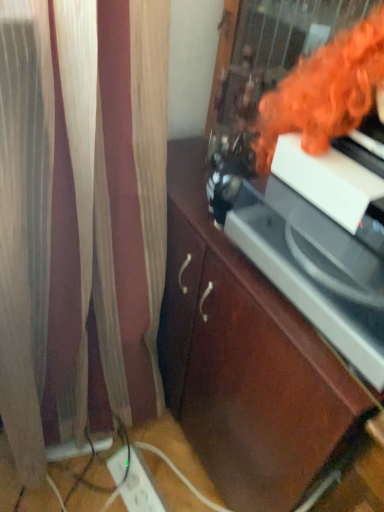
The width and height of the screenshot is (384, 512). What do you see at coordinates (310, 272) in the screenshot?
I see `white glossy record player at center` at bounding box center [310, 272].

What do you see at coordinates (134, 481) in the screenshot? This screenshot has width=384, height=512. I see `white plastic extension cord at lower left` at bounding box center [134, 481].

Find the location of a particular element. The height and width of the screenshot is (512, 384). white plastic extension cord at lower left is located at coordinates 134,481.

Find the location of a particular element. This screenshot has width=384, height=512. white glossy record player at center is located at coordinates (310, 272).

Is orange fabric at upper right inside white plastic extension cord at lower left?

No, white plastic extension cord at lower left does not contain orange fabric at upper right.

Is white plastic extension cord at lower left oriented away from orange fabric at upper right?

white plastic extension cord at lower left is not turned away from orange fabric at upper right.

From the image's perspective, which one is positioned lower, white plastic extension cord at lower left or orange fabric at upper right?

white plastic extension cord at lower left appears lower in the image.

Is point (322, 109) behind point (332, 342)?

No, (322, 109) is in front of (332, 342).

In the scene shown: Based on their sizes in the image, would you say orange fabric at upper right is bigger or smaller than white glossy record player at center?

orange fabric at upper right is bigger than white glossy record player at center.

Is white glossy record player at center with white plastic extension cord at lower left?

They are not placed beside each other.

Could you tell me if white glossy record player at center is turned towards white plastic extension cord at lower left?

No, white glossy record player at center is not aimed at white plastic extension cord at lower left.

I want to click on appliance that appears in front of the white plastic extension cord at lower left, so click(310, 272).

Locate an element on the screen. cabinetry on the left of orange fabric at upper right is located at coordinates (245, 361).

From a real-world perspective, is orange fabric at upper right positioned above or below brown wood cabinet at center?

Clearly, from a real-world perspective, orange fabric at upper right is above brown wood cabinet at center.

Between orange fabric at upper right and brown wood cabinet at center, which one appears on the left side from the viewer's perspective?

brown wood cabinet at center is more to the left.

Can you confirm if orange fabric at upper right is thinner than brown wood cabinet at center?

Yes.

Does brown wood cabinet at center have a lesser height compared to white glossy record player at center?

In fact, brown wood cabinet at center may be taller than white glossy record player at center.

Between brown wood cabinet at center and white glossy record player at center, which one appears on the right side from the viewer's perspective?

Positioned to the right is brown wood cabinet at center.

Between brown wood cabinet at center and white glossy record player at center, which one is positioned behind?

Positioned behind is white glossy record player at center.

Where is `cabinetry in front of the white glossy record player at center`? Image resolution: width=384 pixels, height=512 pixels. cabinetry in front of the white glossy record player at center is located at coordinates (245, 361).

Does white glossy record player at center turn towards orange fabric at upper right?

No, white glossy record player at center is not turned towards orange fabric at upper right.

Between point (273, 234) and point (360, 87), which one is positioned in front?

The point (360, 87) is in front.

Which of these two, white glossy record player at center or orange fabric at upper right, stands shorter?

With less height is white glossy record player at center.

From the image's perspective, is white glossy record player at center located above or below orange fabric at upper right?

Based on their image positions, white glossy record player at center is located beneath orange fabric at upper right.

You are a GUI agent. You are given a task and a screenshot of the screen. Output one action in this format:
    pyautogui.click(x=<x>, y=<y>)
    Task: Click on the extension cord below the white glossy record player at center (from a real-world perspective)
    
    Given the screenshot: What is the action you would take?
    (134, 481)

Who is smaller, white plastic extension cord at lower left or white glossy record player at center?

With smaller size is white plastic extension cord at lower left.

In the scene shown: Is white plastic extension cord at lower left directly adjacent to white glossy record player at center?

No.

Measure the distance from white plastic extension cord at lower left to white glossy record player at center.

The distance of white plastic extension cord at lower left from white glossy record player at center is 32.82 inches.

You are a GUI agent. You are given a task and a screenshot of the screen. Output one action in this format:
    pyautogui.click(x=<x>, y=<y>)
    Task: Click on the extension cord on the left of orange fabric at upper right
    
    Given the screenshot: What is the action you would take?
    pyautogui.click(x=134, y=481)

This screenshot has height=512, width=384. I want to click on appliance behind the orange fabric at upper right, so click(x=310, y=272).

From the image, which object appears to be nearer to orange fabric at upper right, brown wood cabinet at center or white glossy record player at center?

white glossy record player at center is closer to orange fabric at upper right.

Estimate the real-world distances between objects in this image. Which object is closer to orange fabric at upper right, white glossy record player at center or white plastic extension cord at lower left?

white glossy record player at center is closer to orange fabric at upper right.

When comparing their distances from brown wood cabinet at center, does white glossy record player at center or white plastic extension cord at lower left seem closer?

white glossy record player at center is positioned closer to the anchor brown wood cabinet at center.

Which object lies further to the anchor point white plastic extension cord at lower left, brown wood cabinet at center or orange fabric at upper right?

orange fabric at upper right is further to white plastic extension cord at lower left.

From the picture: Estimate the real-world distances between objects in this image. Which object is further from white glossy record player at center, white plastic extension cord at lower left or orange fabric at upper right?

The object further to white glossy record player at center is white plastic extension cord at lower left.

In the scene shown: From the image, which object appears to be farther from white glossy record player at center, brown wood cabinet at center or orange fabric at upper right?

Based on the image, brown wood cabinet at center appears to be further to white glossy record player at center.

Based on their spatial positions, is orange fabric at upper right or white plastic extension cord at lower left closer to brown wood cabinet at center?

orange fabric at upper right is positioned closer to the anchor brown wood cabinet at center.

Looking at the image, which one is located further to orange fabric at upper right, white glossy record player at center or brown wood cabinet at center?

brown wood cabinet at center is positioned further to the anchor orange fabric at upper right.

This screenshot has height=512, width=384. I want to click on cabinetry between white glossy record player at center and white plastic extension cord at lower left in the up-down direction, so click(x=245, y=361).

Find the location of a particular element. This screenshot has height=512, width=384. appliance that lies between orange fabric at upper right and white plastic extension cord at lower left from top to bottom is located at coordinates (310, 272).

You are a GUI agent. You are given a task and a screenshot of the screen. Output one action in this format:
    pyautogui.click(x=<x>, y=<y>)
    Task: Click on the appliance that lies between orange fabric at upper right and brown wood cabinet at center from top to bottom
    The height and width of the screenshot is (512, 384).
    Given the screenshot: What is the action you would take?
    pyautogui.click(x=310, y=272)

Where is `cabinetry between orange fabric at upper right and white plastic extension cord at lower left from top to bottom`? The height and width of the screenshot is (512, 384). cabinetry between orange fabric at upper right and white plastic extension cord at lower left from top to bottom is located at coordinates (245, 361).